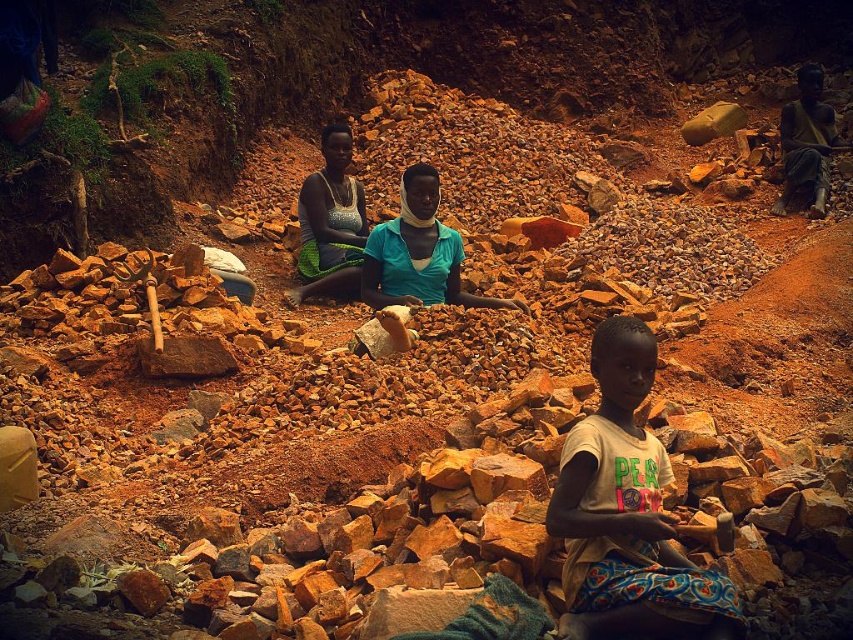
Describe the element at coordinates (627, 515) in the screenshot. The width and height of the screenshot is (853, 640). I see `light brown cotton shirt at center` at that location.

Measure the distance between point (579, 636) and camera.

Answer: They are 9.07 meters apart.

This screenshot has width=853, height=640. Identify the location of light brown cotton shirt at center. (627, 515).

Is light brown cotton shirt at center closer to the viewer compared to dark skin person at right?

Yes, light brown cotton shirt at center is in front of dark skin person at right.

Between point (643, 600) and point (840, 140), which one is positioned in front?

Point (643, 600) is more forward.

The height and width of the screenshot is (640, 853). Identify the location of light brown cotton shirt at center. (627, 515).

The width and height of the screenshot is (853, 640). I want to click on light brown cotton shirt at center, so click(x=627, y=515).

Who is more distant from viewer, (358, 250) or (813, 154)?

The point (813, 154) is more distant.

Between point (323, 234) and point (817, 202), which one is positioned behind?

Point (817, 202)

Locate an element on the screen. shiny metallic necklace at center is located at coordinates (329, 224).